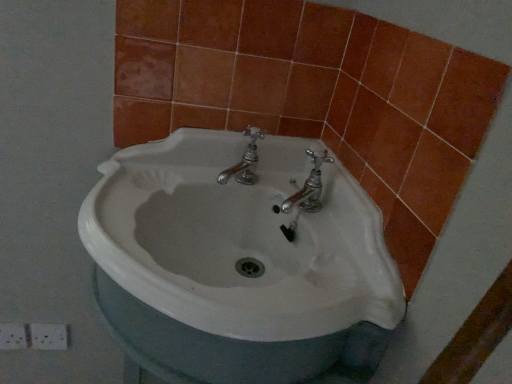
Question: Is orange matte tile at upper right, positioned as the first ceramic tile in left-to-right order, wider or thinner than orange ceramic tile at lower left, which ranks as the first ceramic tile in right-to-left order?

Choices:
 (A) wide
 (B) thin

Answer: (A)

Question: Based on their positions, is orange matte tile at upper right, which is the second ceramic tile in right-to-left order, located to the left or right of orange ceramic tile at lower left, acting as the second ceramic tile starting from the left?

Choices:
 (A) right
 (B) left

Answer: (B)

Question: Estimate the real-world distances between objects in this image. Which object is farther from the orange ceramic tile at lower left, acting as the second ceramic tile starting from the left?

Choices:
 (A) orange matte tile at upper right, which is the second ceramic tile in right-to-left order
 (B) white ceramic sink at center

Answer: (B)

Question: Considering the real-world distances, which object is farthest from the orange matte tile at upper right, positioned as the first ceramic tile in left-to-right order?

Choices:
 (A) white ceramic sink at center
 (B) orange ceramic tile at lower left, which ranks as the first ceramic tile in right-to-left order

Answer: (A)